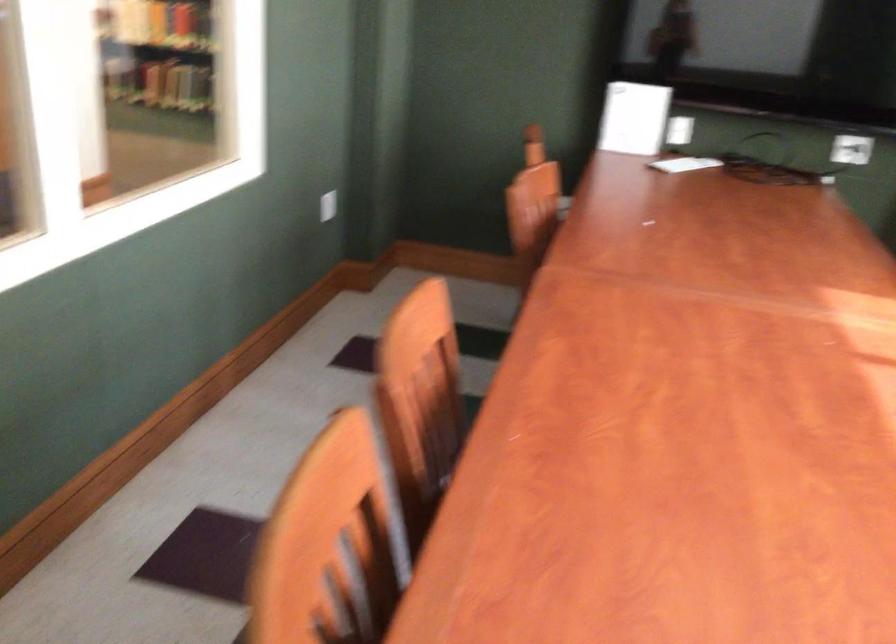
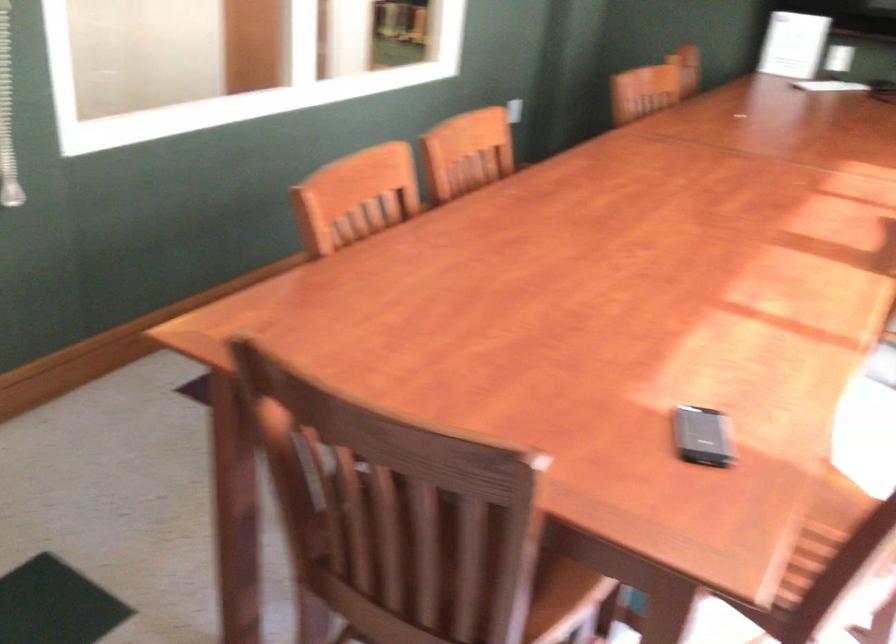
What movement of the cameraman would produce the second image?

The movement direction of the cameraman is right, backward.